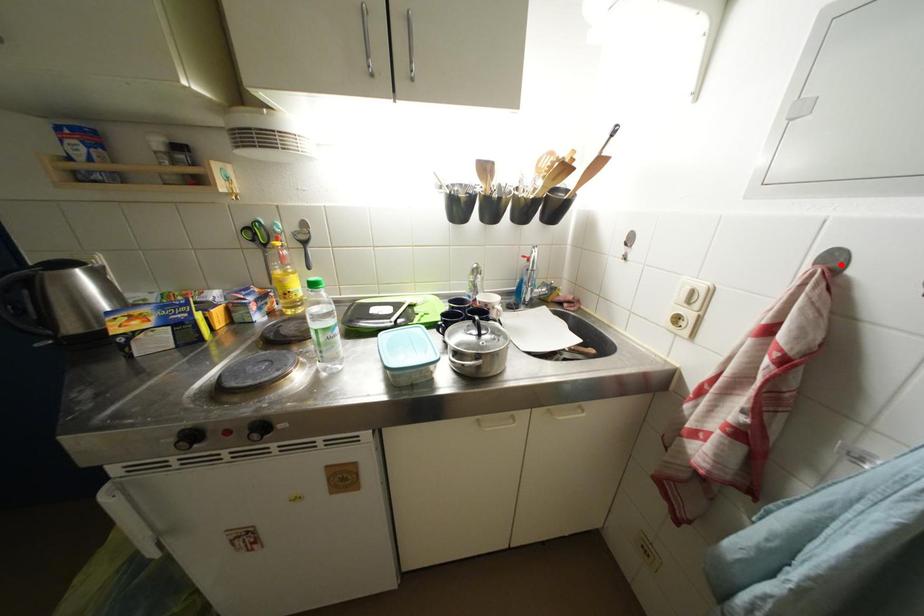
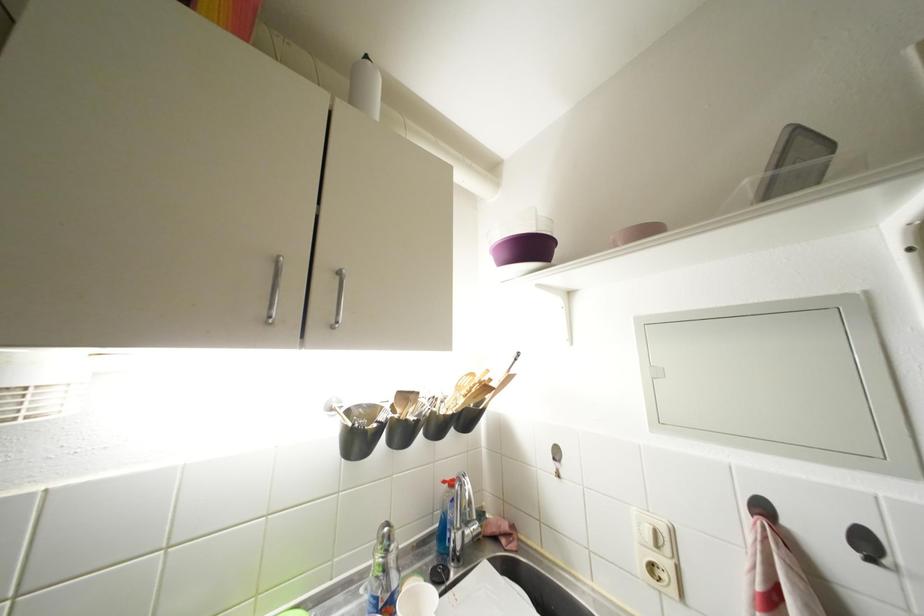
The point at the highlighted location is marked in the first image. Where is the corresponding point in the second image?

(770, 513)